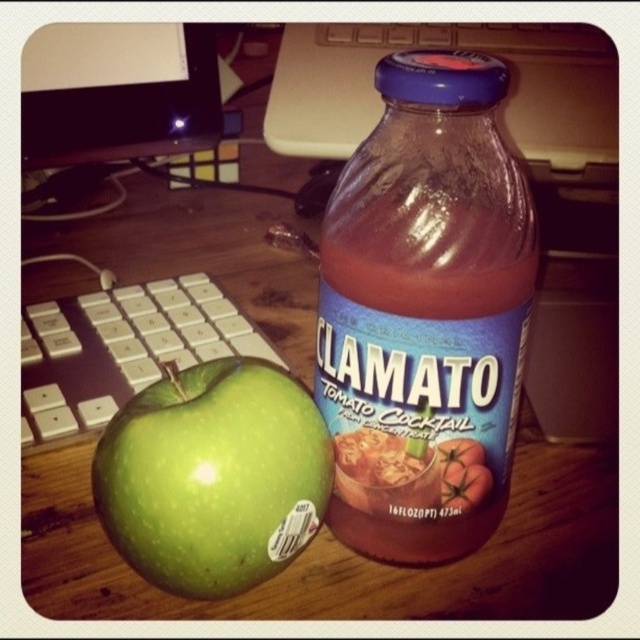
Question: Can you confirm if translucent glass bottle at center is bigger than green matte apple at lower left?

Choices:
 (A) yes
 (B) no

Answer: (A)

Question: Among these points, which one is farthest from the camera?

Choices:
 (A) (285, 525)
 (B) (470, 72)

Answer: (A)

Question: Which point is farther to the camera?

Choices:
 (A) (454, 109)
 (B) (163, 570)

Answer: (B)

Question: Is translucent glass bottle at center to the right of green matte apple at lower left from the viewer's perspective?

Choices:
 (A) yes
 (B) no

Answer: (A)

Question: Which object appears closest to the camera in this image?

Choices:
 (A) translucent glass bottle at center
 (B) green matte apple at lower left

Answer: (A)

Question: Is translucent glass bottle at center above green matte apple at lower left?

Choices:
 (A) yes
 (B) no

Answer: (A)